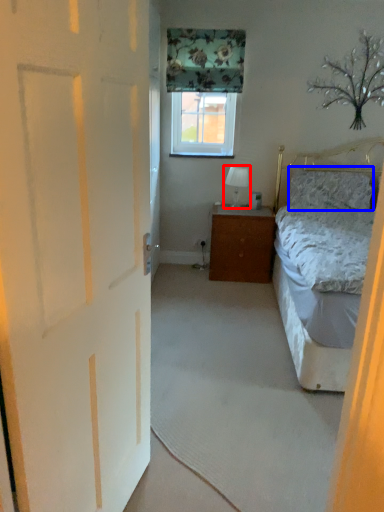
Question: Which object appears closest to the camera in this image, table lamp (highlighted by a red box) or pillow (highlighted by a blue box)?

Choices:
 (A) table lamp
 (B) pillow

Answer: (B)